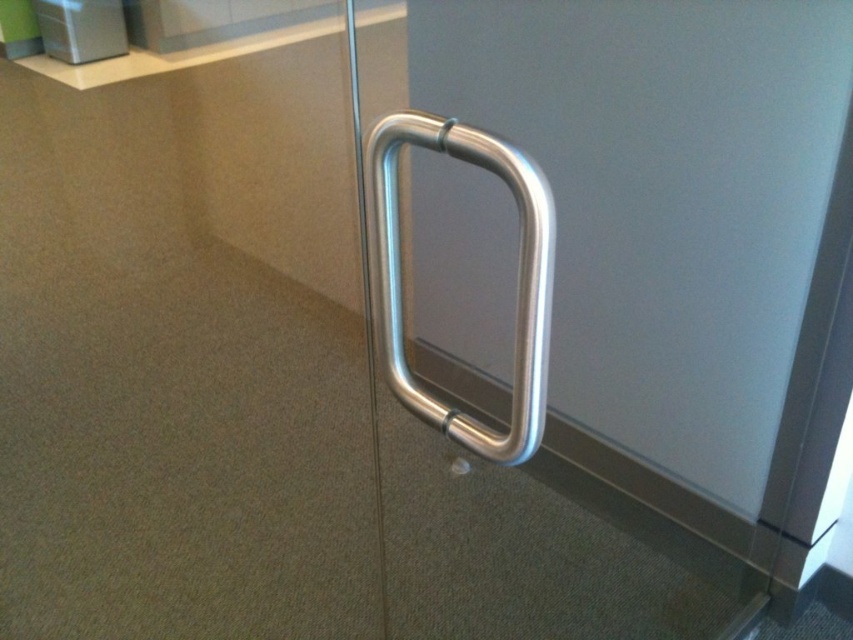
From the picture: Is silver metallic handle at center to the left of polished metal door handle at right from the viewer's perspective?

No, silver metallic handle at center is not to the left of polished metal door handle at right.

Identify the location of silver metallic handle at center. This screenshot has width=853, height=640. (624, 316).

Where is `silver metallic handle at center`? silver metallic handle at center is located at coordinates (624, 316).